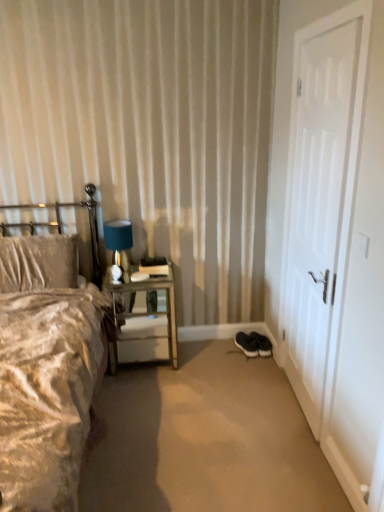
Where is `free space above black rubber shoes at lower right (from a real-world perspective)`? Image resolution: width=384 pixels, height=512 pixels. free space above black rubber shoes at lower right (from a real-world perspective) is located at coordinates point(221,412).